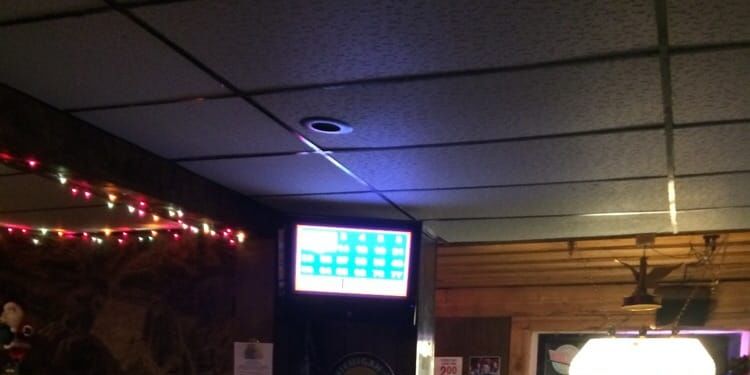
I want to click on top of darts board, so click(358, 361).